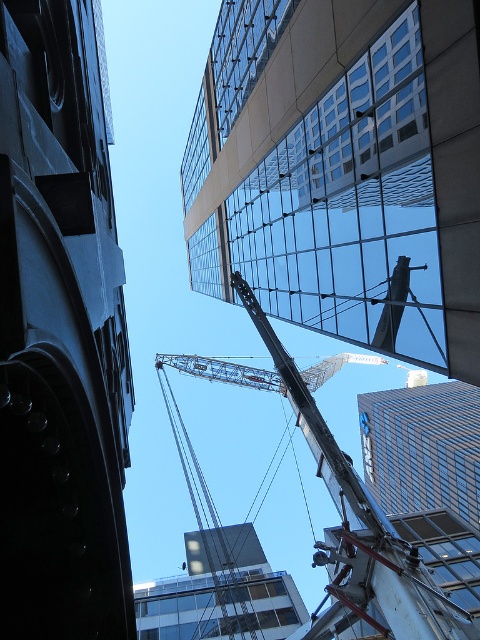
You are standing in the city square and want to take a photo of both the dark gray stone tower at left and the metallic gray crane at center. Which object should you position closer to you in the frame to ensure both are visible without zooming?

You should position the dark gray stone tower at left closer to you in the frame since it is already closer to the viewer than the metallic gray crane at center, allowing both to be captured without zooming.

You are a city planner reviewing this urban scene. You need to determine if the glassy reflective building at upper center can be seen in full from the street level without obstruction. Considering the presence of the metallic gray crane at center, which is wider, would the building be fully visible?

The glassy reflective building at upper center has a lesser width compared to the metallic gray crane at center. Since the crane is wider, it may obstruct parts of the building from street level, making it not fully visible.